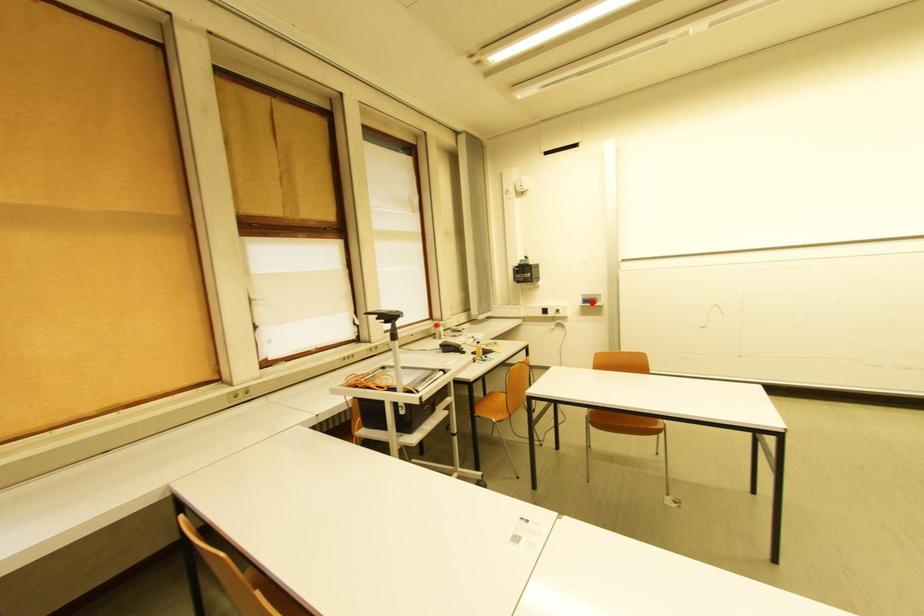
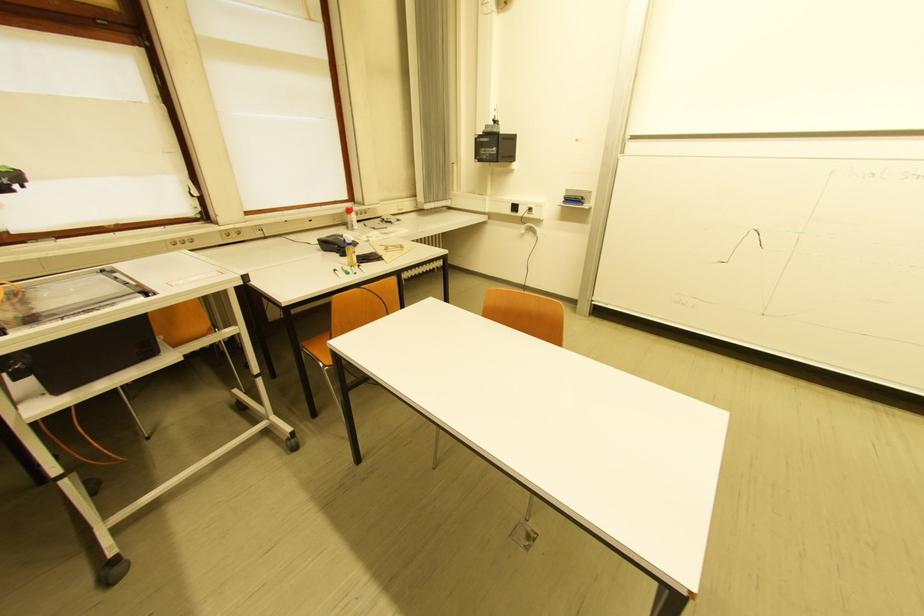
In the second image, find the point that corresponds to the highlighted location in the first image.

(575, 201)